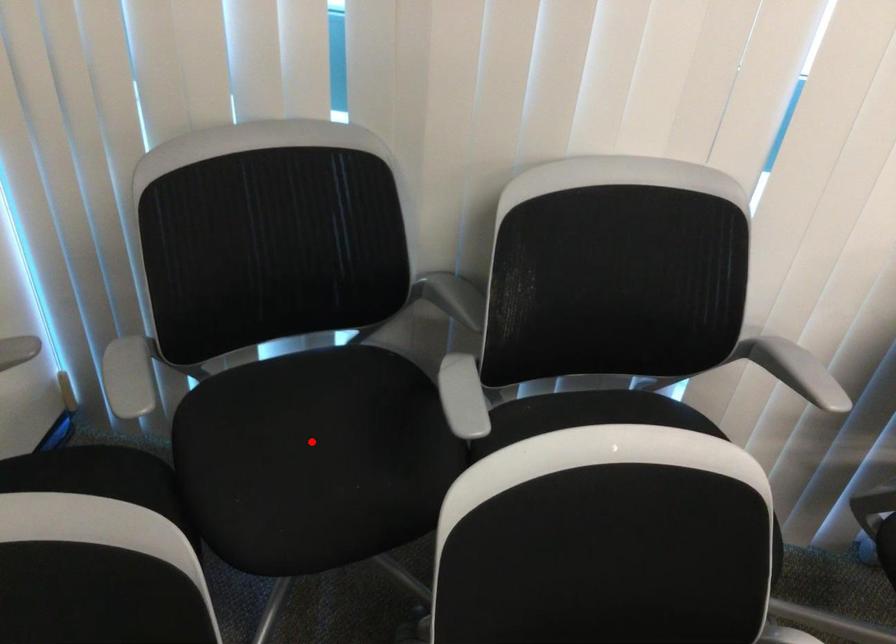
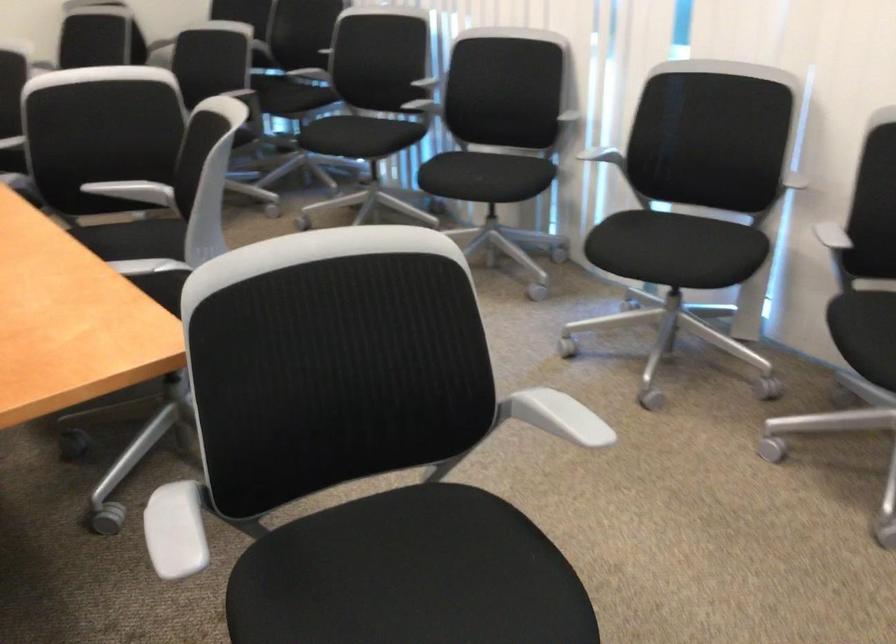
Question: I am providing you with two images of the same scene from different viewpoints. A red point is marked on the first image. Can you still see the location of the red point in image 2?

Choices:
 (A) Yes
 (B) No

Answer: (B)